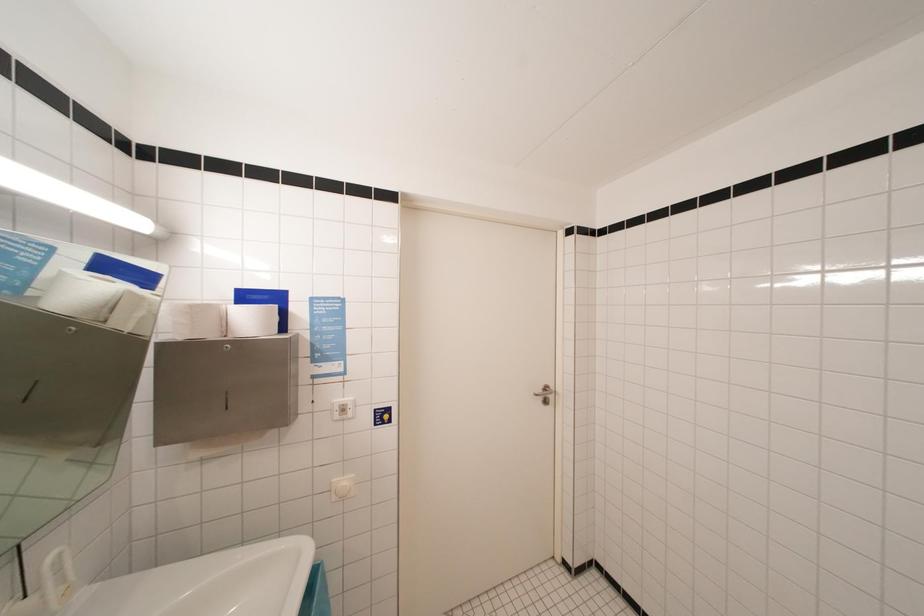
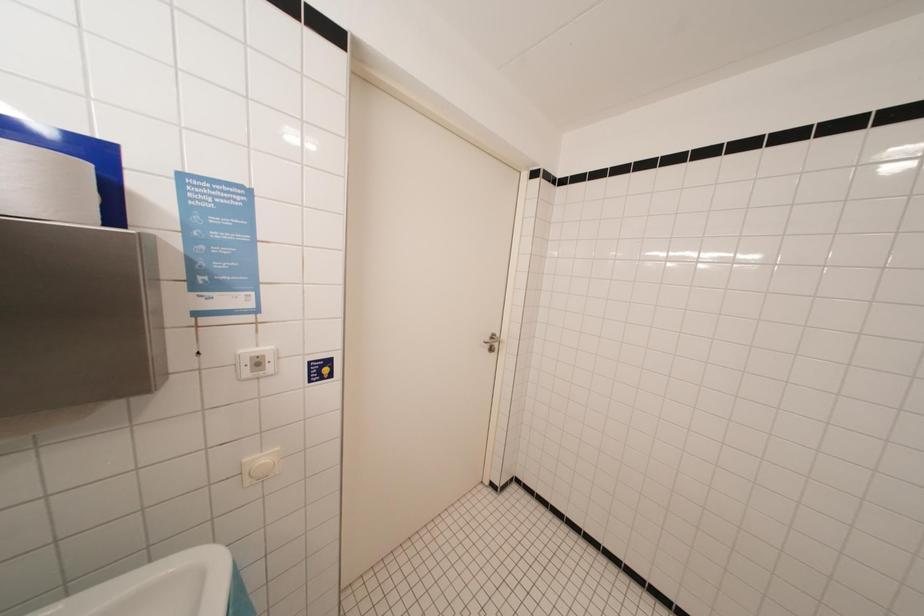
Question: Based on the continuous images, in which direction is the camera rotating? Reply with the corresponding letter.

Choices:
 (A) Left
 (B) Right
 (C) Up
 (D) Down

Answer: (B)